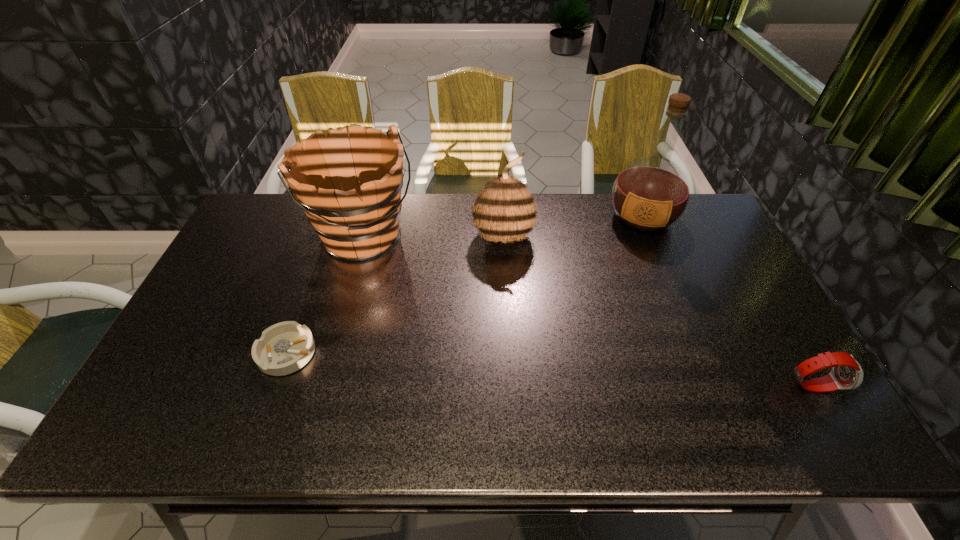
This screenshot has width=960, height=540. Identify the location of the shortest object. (285, 347).

The image size is (960, 540). I want to click on the rightmost object, so click(x=846, y=373).

The width and height of the screenshot is (960, 540). Find the location of `watch`. watch is located at coordinates (846, 373).

Identify the location of coconut. (504, 210).

You are a GUI agent. You are given a task and a screenshot of the screen. Output one action in this format:
    pyautogui.click(x=<x>, y=<y>)
    Task: Click on the liquor
    
    Given the screenshot: What is the action you would take?
    pyautogui.click(x=650, y=194)

Locate an element on the screen. The height and width of the screenshot is (540, 960). the fourth object from left to right is located at coordinates (650, 194).

Identify the location of wine bucket. (349, 187).

Image resolution: width=960 pixels, height=540 pixels. Find the location of `vacant position located on the front of the ashtray`. vacant position located on the front of the ashtray is located at coordinates (271, 400).

Locate an element on the screen. vacant point located on the surface of the third object from left to right is located at coordinates (537, 285).

Locate an element on the screen. This screenshot has width=960, height=540. vacant space located 0.160m on the surface of the third object from left to right is located at coordinates (541, 292).